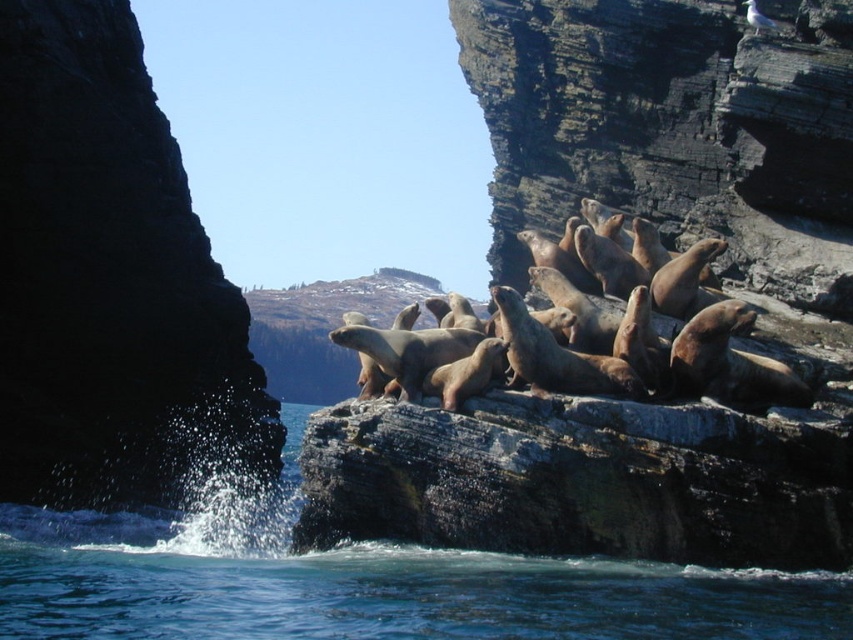
You are standing at the point marked as point (109, 282) in the image. Looking towards the dark rock cliff at left, which direction should you walk to avoid the cliff and head towards the sea lions resting on the rocky outcrop?

Since the dark rock cliff at left is located to your left side at point (109, 282), you should walk to the right to avoid the cliff and move towards the sea lions resting on the rocky outcrop.

You are standing at the edge of the rocky outcrop where the sea lions are resting. You want to jump into the water. Which direction should you jump to reach the clear blue water at lower center?

You should jump towards the lower center direction to reach the clear blue water at lower center, as its position is at point (366, 582).

You are a photographer standing at the camera position. You want to capture a closeup shot of the point at coordinates (x=1, y=600). Given that your telephoto lens can focus on objects up to 40 meters away, will you be able to take the shot?

The point at coordinates (x=1, y=600) is 38.95 meters from the camera, so yes, the telephoto lens can focus on it since it is within the 40 meters range.